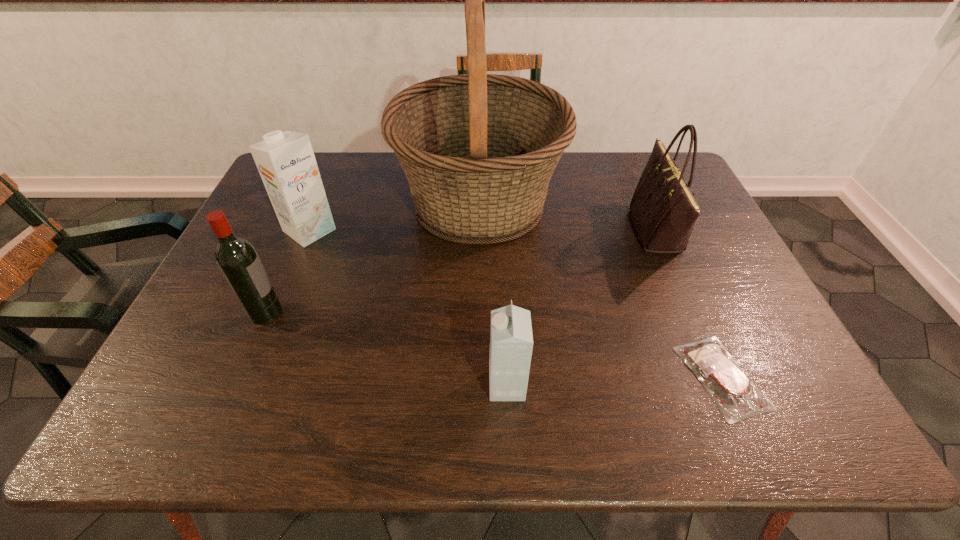
The height and width of the screenshot is (540, 960). I want to click on steak at the near edge, so click(737, 398).

Locate an element on the screen. The height and width of the screenshot is (540, 960). carton present at the left edge is located at coordinates (286, 162).

In order to click on wine bottle at the left edge in this screenshot , I will do (236, 257).

Identify the location of handbag located at the right edge. (663, 210).

Identify the location of steak present at the right edge. The height and width of the screenshot is (540, 960). (737, 398).

Locate an element on the screen. This screenshot has width=960, height=540. object present at the near right corner is located at coordinates pyautogui.click(x=737, y=398).

Image resolution: width=960 pixels, height=540 pixels. Identify the location of vacant space at the far edge. (596, 186).

You are a GUI agent. You are given a task and a screenshot of the screen. Output one action in this format:
    pyautogui.click(x=<x>, y=<y>)
    Task: Click on the vacant region at the right edge of the desktop
    The image size is (960, 540).
    Given the screenshot: What is the action you would take?
    pyautogui.click(x=782, y=361)

This screenshot has height=540, width=960. I want to click on free space that is in between the handbag and the shorter carton, so click(582, 308).

Find the location of a particular element. Image resolution: width=960 pixels, height=540 pixels. free spot between the left carton and the shorter carton is located at coordinates (408, 308).